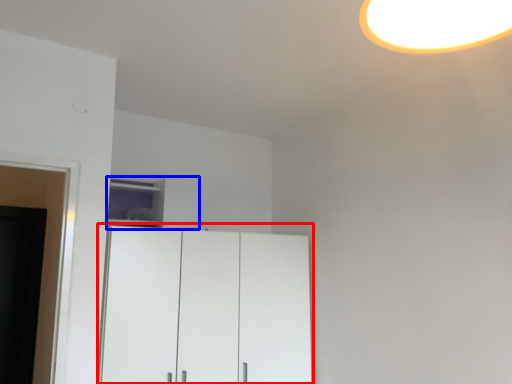
Question: Which point is closer to the camera, cupboard (highlighted by a red box) or cabinetry (highlighted by a blue box)?

Choices:
 (A) cupboard
 (B) cabinetry

Answer: (A)